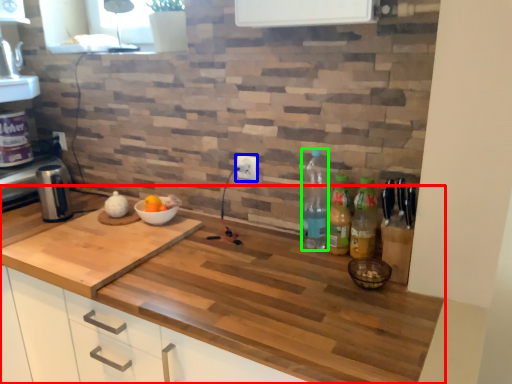
Question: Which object is the closest to the countertop (highlighted by a red box)? Choose among these: electric outlet (highlighted by a blue box) or bottle (highlighted by a green box).

Choices:
 (A) electric outlet
 (B) bottle

Answer: (B)